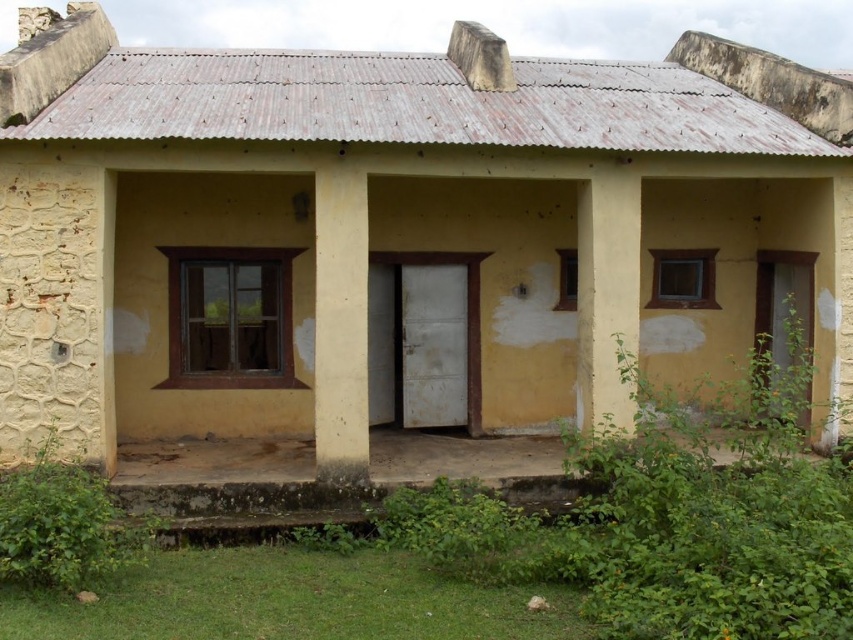
You are a delivery person trying to place a large package between the white smooth pillar at center and the yellow matte pillar at center. The package is 3 meters long. Can you fit it between them?

The distance between the white smooth pillar at center and the yellow matte pillar at center is 2.51 meters. Since the package is 3 meters long, it cannot fit between them as the space is shorter than the package.

You are standing in front of the building and notice two points marked on its facade. The first point is at coordinate point(x=345, y=337) and the second is at point(x=585, y=317). Which of these points is nearer to you?

Point(x=345, y=337) is closer to the viewer than point(x=585, y=317).

In the scene shown: You are a delivery person trying to park your 1.2 meter wide cart between the white smooth pillar at center and the yellow matte pillar at center. Can you fit your cart between them?

The white smooth pillar at center is narrower than the yellow matte pillar at center, but the description does not provide the distance between them. Therefore, it is unclear if the 1.2 meter wide cart can fit between them.